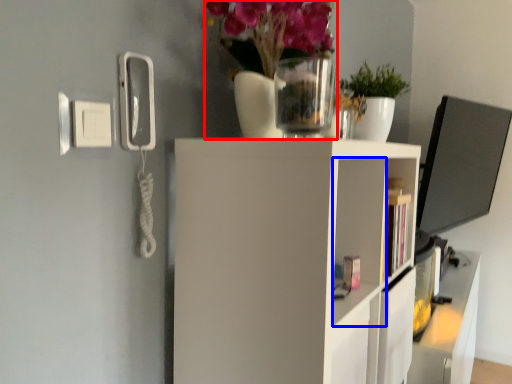
Question: Which object is further to the camera taking this photo, floral arrangement (highlighted by a red box) or cabinet (highlighted by a blue box)?

Choices:
 (A) floral arrangement
 (B) cabinet

Answer: (B)